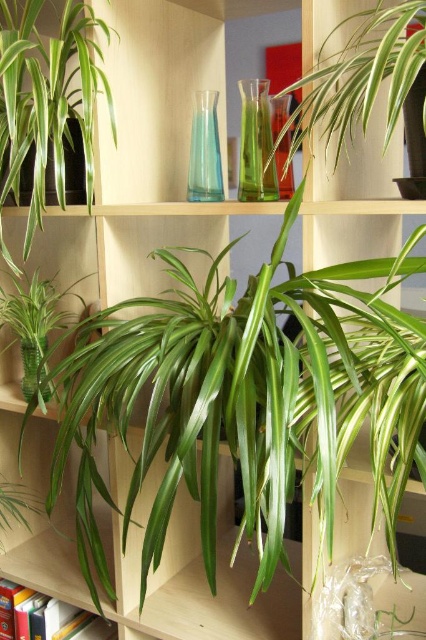
You are arranging flowers in the transparent glass vase at center and the transparent glass vase at lower left. Which vase will require fewer flowers to fill it up?

The transparent glass vase at center requires fewer flowers to fill it up because its width is less than the transparent glass vase at lower left, implying it has a smaller capacity.

You are organizing a shelf and see the green glossy plant at upper left and the green glossy plant at center. Which plant is located to the right of the other?

The green glossy plant at upper left is positioned on the right side of the green glossy plant at center.

What are the coordinates of the green glossy plant at upper left?

The green glossy plant at upper left is located at coordinates point (x=46, y=99).